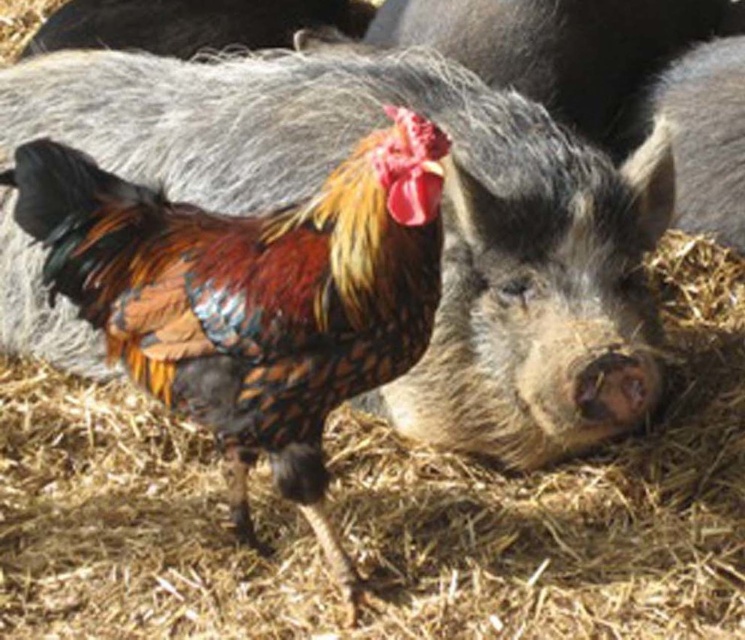
Which of these two, gray fur pig at center or multicolored feathered rooster at center, stands taller?

gray fur pig at center is taller.

Which is behind, point (129, 83) or point (89, 182)?

The point (129, 83) is more distant.

This screenshot has height=640, width=745. What are the coordinates of `gray fur pig at center` in the screenshot? It's located at (443, 212).